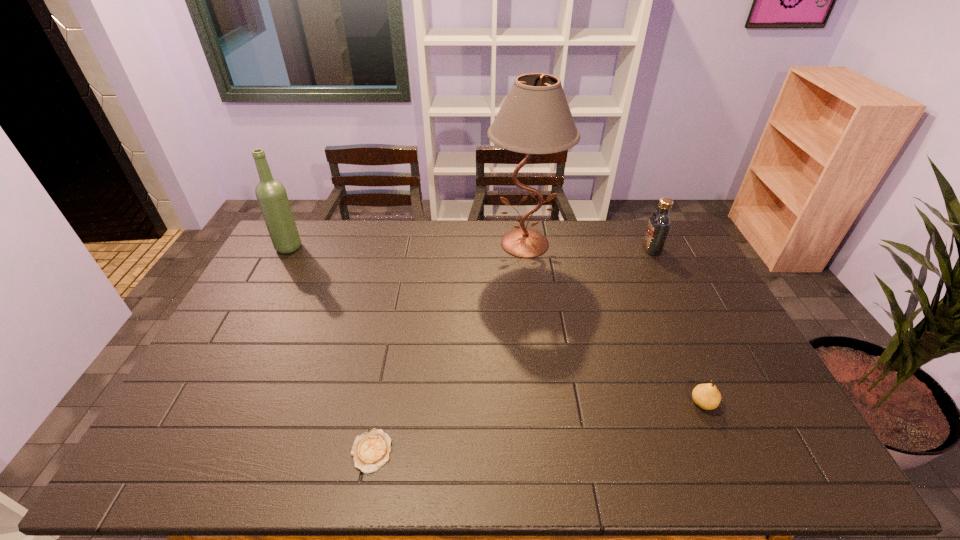
In order to click on free space that satisfies the following two spatial constraints: 1. on the front-facing side of the fourth farthest object; 2. on the right side of the table lamp in this screenshot , I will do `click(545, 403)`.

Identify the location of free space in the image that satisfies the following two spatial constraints: 1. on the front side of the leftmost object; 2. on the left side of the pear. Image resolution: width=960 pixels, height=540 pixels. (204, 403).

This screenshot has width=960, height=540. In order to click on vacant area in the image that satisfies the following two spatial constraints: 1. on the front-facing side of the table lamp; 2. on the left side of the fourth tallest object in this screenshot , I will do click(545, 403).